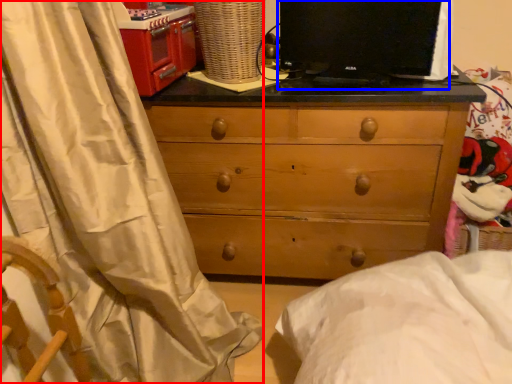
Question: Which point is further to the camera, curtain (highlighted by a red box) or computer monitor (highlighted by a blue box)?

Choices:
 (A) curtain
 (B) computer monitor

Answer: (B)